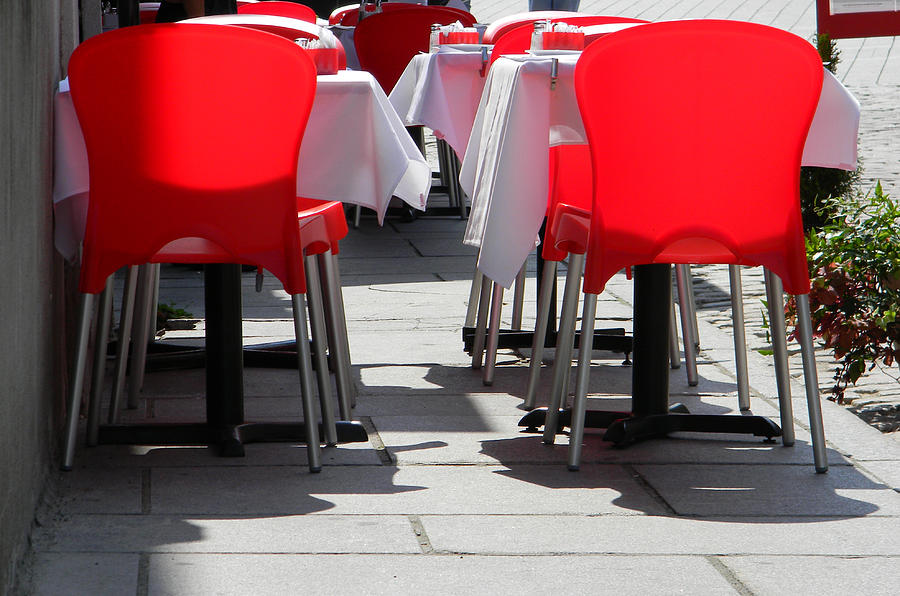
Where is `black table pole`? black table pole is located at coordinates (221, 387), (650, 349), (544, 272), (216, 306), (418, 139).